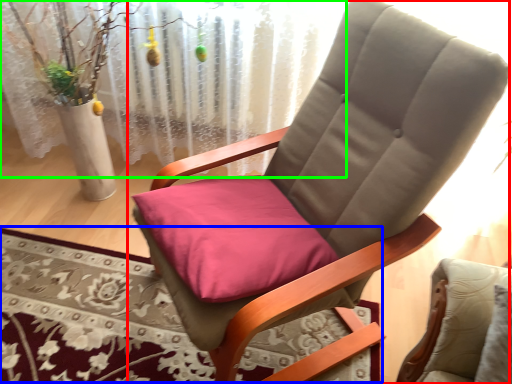
Question: Considering the real-world distances, which object is farthest from chair (highlighted by a red box)? mat (highlighted by a blue box) or curtain (highlighted by a green box)?

Choices:
 (A) mat
 (B) curtain

Answer: (B)